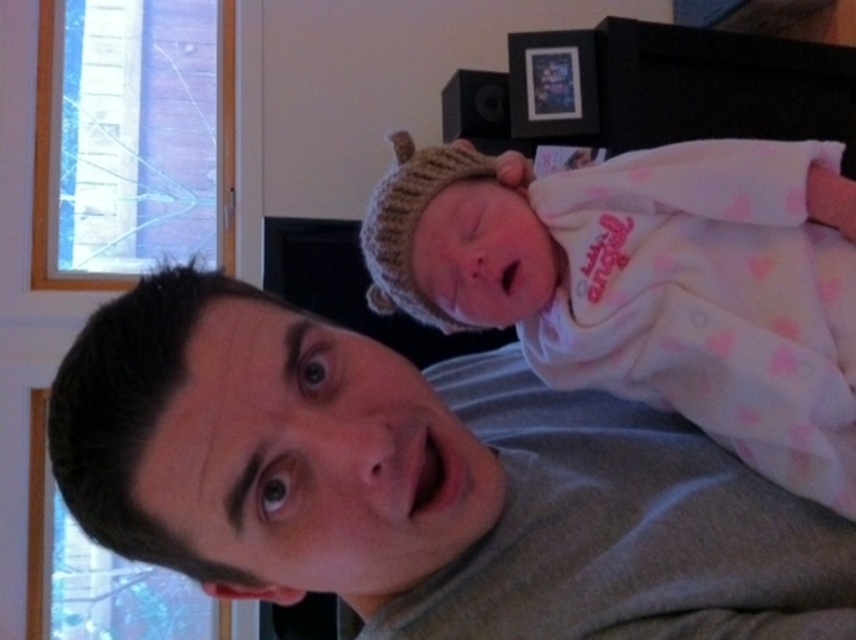
Question: Which of the following is the farthest from the observer?

Choices:
 (A) gray cotton shirt at upper center
 (B) white knit hat at upper center

Answer: (B)

Question: Among these points, which one is farthest from the camera?

Choices:
 (A) [614, 246]
 (B) [425, 625]

Answer: (A)

Question: Is gray cotton shirt at upper center further to camera compared to white knit hat at upper center?

Choices:
 (A) yes
 (B) no

Answer: (B)

Question: Does gray cotton shirt at upper center appear on the left side of white knit hat at upper center?

Choices:
 (A) no
 (B) yes

Answer: (B)

Question: Is gray cotton shirt at upper center further to the viewer compared to white knit hat at upper center?

Choices:
 (A) yes
 (B) no

Answer: (B)